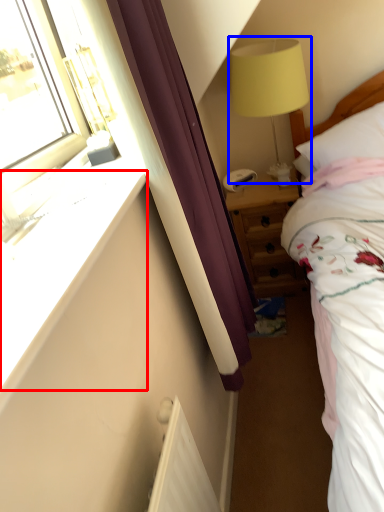
Question: Which object appears closest to the camera in this image, window sill (highlighted by a red box) or table lamp (highlighted by a blue box)?

Choices:
 (A) window sill
 (B) table lamp

Answer: (A)